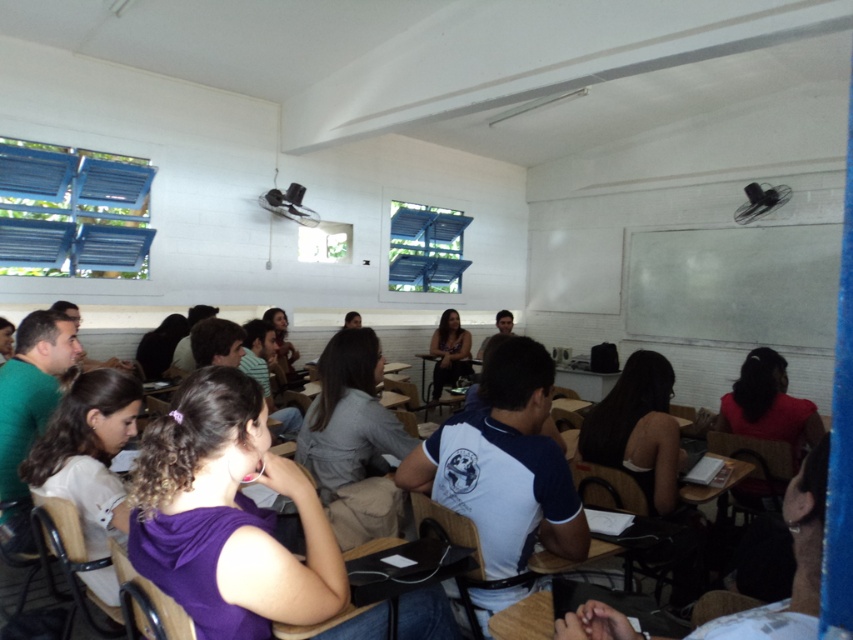
Does white matte chalkboard at upper right have a greater height compared to matte black dress at center?

Yes, white matte chalkboard at upper right is taller than matte black dress at center.

Which is behind, point (726, 237) or point (445, 349)?

Positioned behind is point (445, 349).

Between point (662, 292) and point (444, 312), which one is positioned behind?

Point (662, 292)

The height and width of the screenshot is (640, 853). I want to click on white matte chalkboard at upper right, so tap(735, 285).